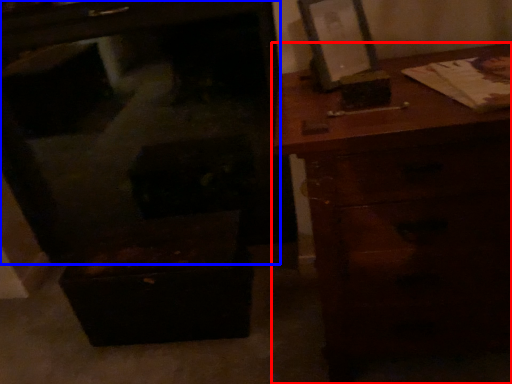
Question: Which point is further to the camera, chest of drawers (highlighted by a red box) or furniture (highlighted by a blue box)?

Choices:
 (A) chest of drawers
 (B) furniture

Answer: (B)